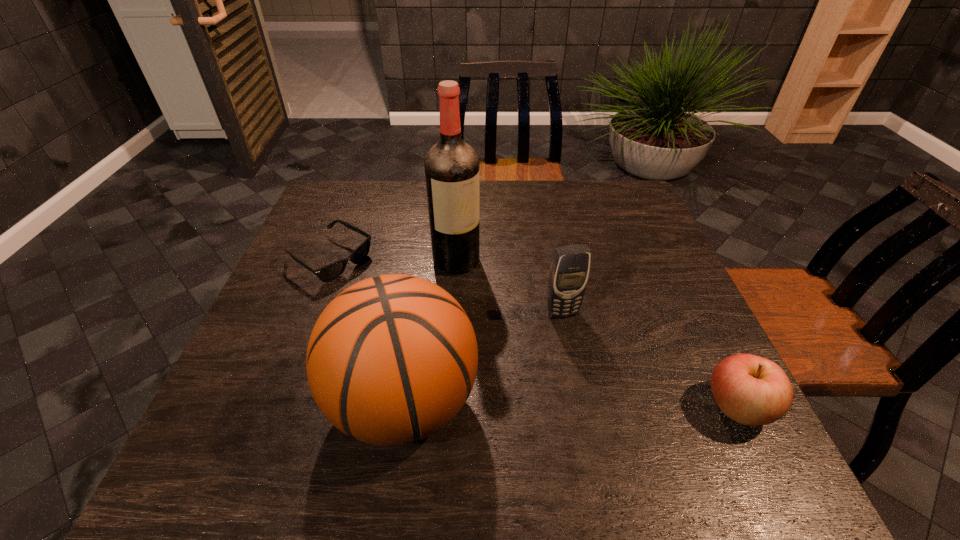
Locate an element on the screen. The height and width of the screenshot is (540, 960). free spot on the desktop that is between the second tallest object and the rightmost object and is positioned on the front-facing side of the shortest object is located at coordinates (567, 404).

This screenshot has width=960, height=540. I want to click on vacant space on the desktop that is between the second tallest object and the rightmost object and is positioned on the front face of the cellular telephone, so click(x=602, y=405).

The image size is (960, 540). I want to click on vacant spot on the desktop that is between the fourth shortest object and the rightmost object and is positioned on the front-facing side of the liquor, so click(x=591, y=405).